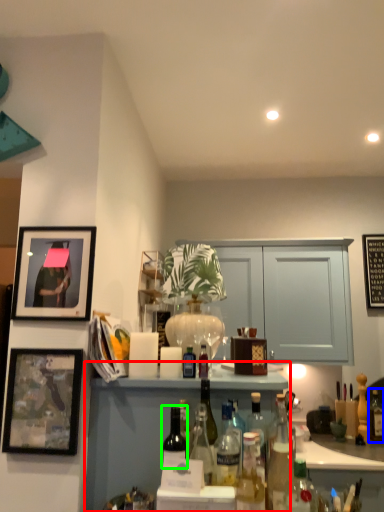
Question: Based on their relative distances, which object is nearer to cabinetry (highlighted by a red box)? Choose from bottle (highlighted by a blue box) and bottle (highlighted by a green box).

Choices:
 (A) bottle
 (B) bottle

Answer: (B)